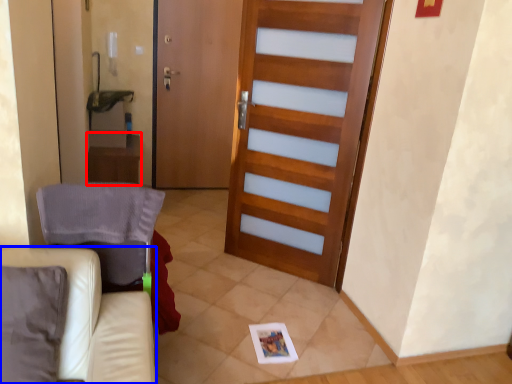
Question: Which object appears farthest to the camera in this image, table (highlighted by a red box) or furniture (highlighted by a blue box)?

Choices:
 (A) table
 (B) furniture

Answer: (A)